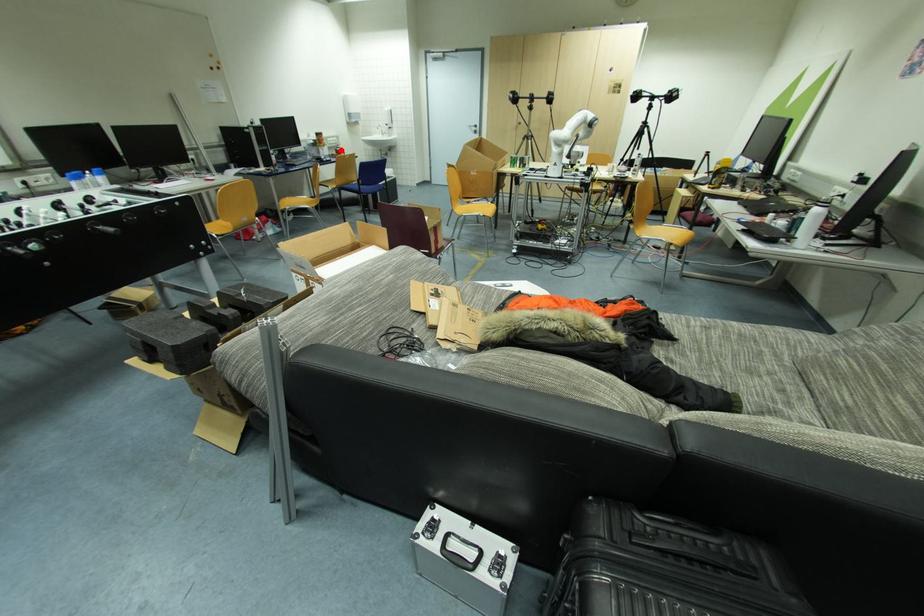
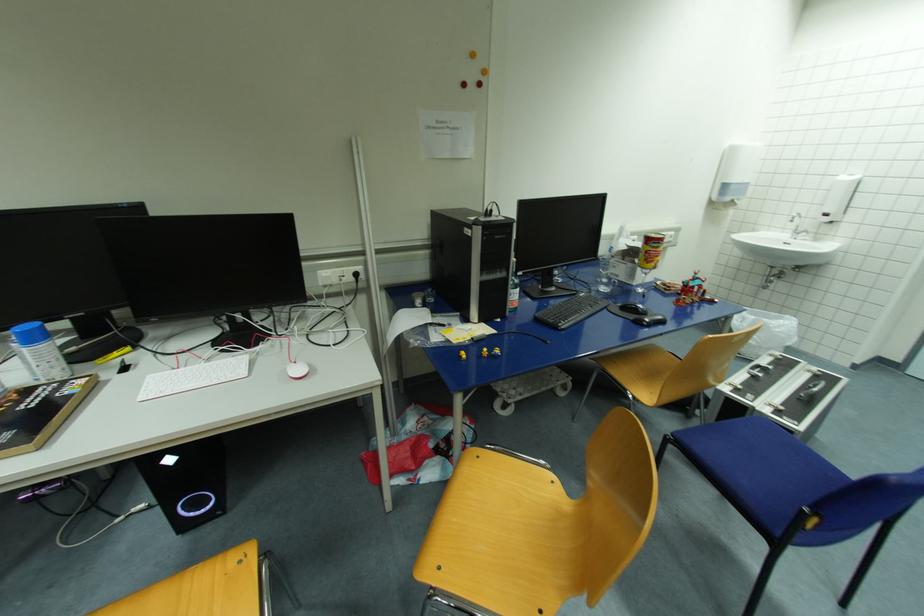
Question: I am providing you with two images of the same scene from different viewpoints. Given a red point in image1, look at the same physical point in image2. Is it:

Choices:
 (A) Closer to the viewpoint
 (B) Farther from the viewpoint

Answer: (B)